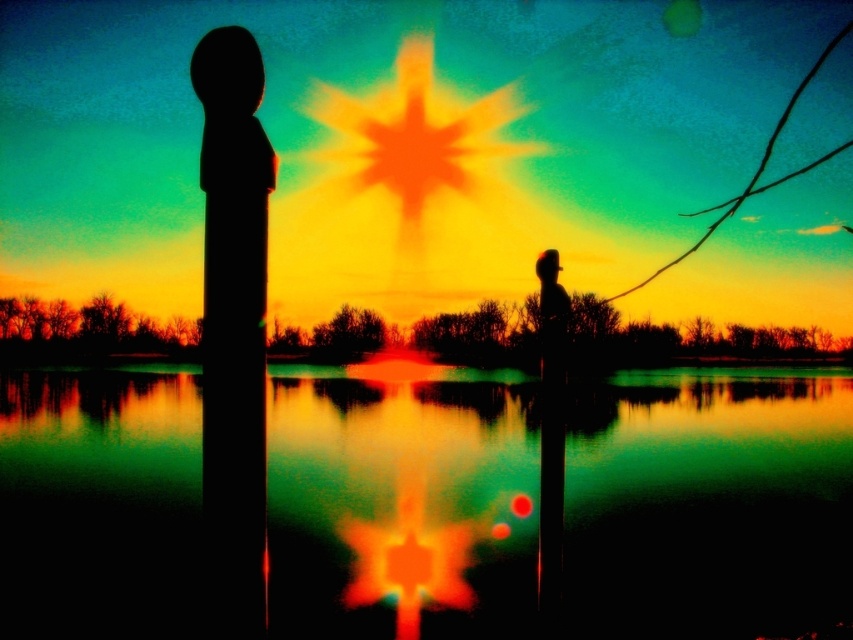
Question: Does green reflective water at center appear over black matte pillar at left?

Choices:
 (A) yes
 (B) no

Answer: (B)

Question: Which object appears farthest from the camera in this image?

Choices:
 (A) green reflective water at center
 (B) black matte pillar at left

Answer: (A)

Question: In this image, where is green reflective water at center located relative to black matte pillar at left?

Choices:
 (A) right
 (B) left

Answer: (A)

Question: Is green reflective water at center wider than black matte pillar at left?

Choices:
 (A) yes
 (B) no

Answer: (A)